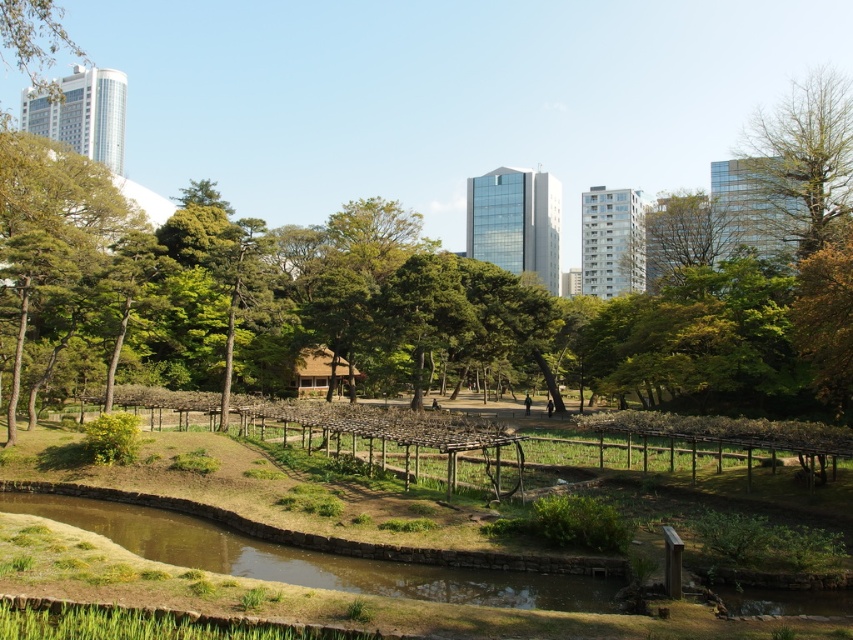
You are a gardener planning to install a new trellis in the park. You have a trellis that is the same width as the green leafy tree at upper center. Will your new trellis be narrower than the green wooden trellis at center?

Yes, the new trellis will be narrower than the green wooden trellis at center because the green wooden trellis at center is wider than the green leafy tree at upper center according to the description.

You are a park visitor who wants to take a photo of both the green wooden trellis at center and the bare wood tree at upper right. Based on their sizes, which object should you focus on first to ensure both fit in the frame?

The green wooden trellis at center occupies less space than the bare wood tree at upper right, so you should focus on the bare wood tree at upper right first to ensure both fit in the frame.

You are a park visitor standing at the edge of the pond. You want to walk towards the bare wood tree at upper right but need to pass between the green wooden trellis at center and the tree. Is the path between them wide enough for you to walk through comfortably?

The green wooden trellis at center is to the left of the bare wood tree at upper right, so the path between them is wide enough for comfortable passage.